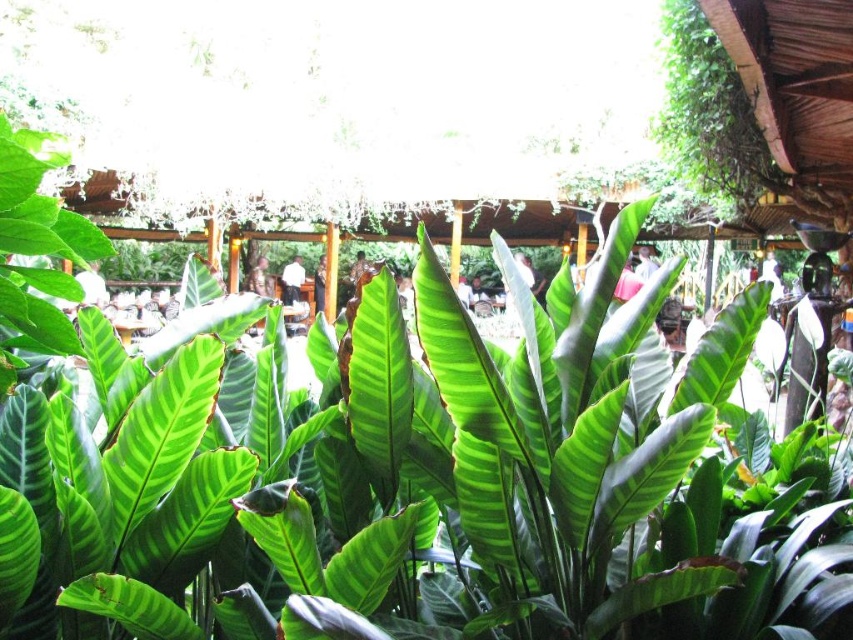
Question: Considering the real-world distances, which object is farthest from the dark brown leather jacket at center?

Choices:
 (A) light brown wooden chair at center
 (B) white shirt at center

Answer: (A)

Question: Based on their relative distances, which object is nearer to the light brown wooden chair at center?

Choices:
 (A) white shirt at center
 (B) dark brown leather jacket at center

Answer: (A)

Question: Does white fabric shirt at upper center have a greater width compared to light brown wooden chair at center?

Choices:
 (A) no
 (B) yes

Answer: (B)

Question: Is white shirt at center behind white fabric shirt at upper center?

Choices:
 (A) no
 (B) yes

Answer: (B)

Question: Is light brown wooden chair at center above dark brown leather jacket at center?

Choices:
 (A) yes
 (B) no

Answer: (A)

Question: Which object appears closest to the camera in this image?

Choices:
 (A) dark brown leather jacket at center
 (B) light brown wooden chair at center

Answer: (B)